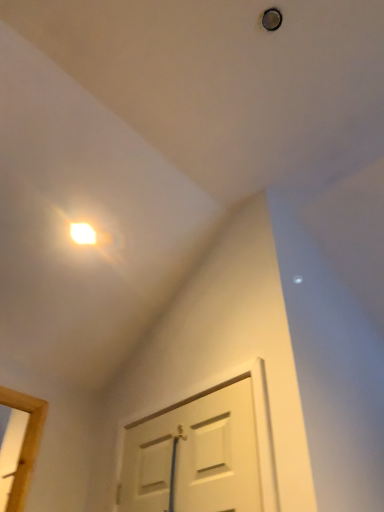
This screenshot has height=512, width=384. What are the coordinates of `matte white droplight at upper left` in the screenshot? It's located at (83, 233).

This screenshot has height=512, width=384. What do you see at coordinates (83, 233) in the screenshot? I see `matte white droplight at upper left` at bounding box center [83, 233].

What is the approximate height of matte white droplight at upper left?

matte white droplight at upper left is 4.30 inches in height.

This screenshot has height=512, width=384. Identify the location of matte white droplight at upper left. (83, 233).